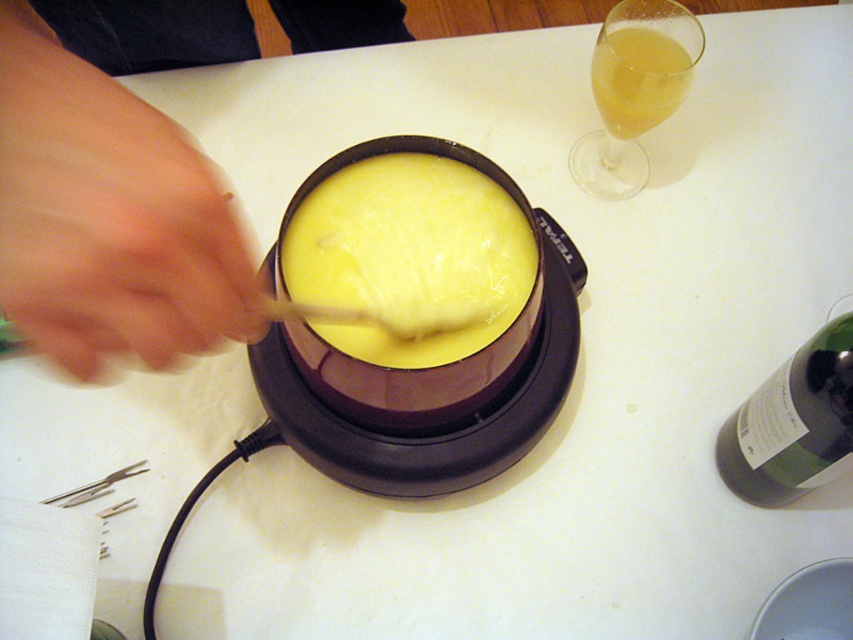
You are holding a wooden fondue fork and want to reach the stemmed glass to the right of the fondue pot. The point you need to reach is marked as point (x=33, y=129). Considering the distance between you and this point is 11.22 inches, can you safely extend your arm to grab the glass without spilling the cheese?

The distance between you and point (x=33, y=129) is 11.22 inches. Since this distance is within a typical arm reach, you can safely extend your arm to grab the stemmed glass without spilling the cheese.

You are a guest at a fondue party and want to reach for both the skinny wooden stick at left and the translucent glass at upper right. If your hand can extend 12 inches, will you be able to grab both items without moving your arm?

The distance between the skinny wooden stick at left and the translucent glass at upper right is 13.40 inches. Since your hand can only extend 12 inches, you cannot reach both items without moving your arm.